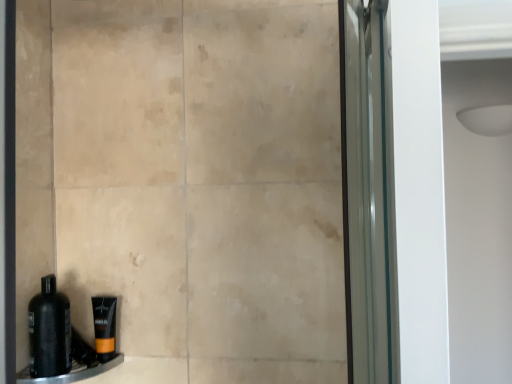
Question: From the image's perspective, is orange matte tube at lower left above black plastic ledge at lower left?

Choices:
 (A) yes
 (B) no

Answer: (A)

Question: From the image's perspective, is orange matte tube at lower left beneath black plastic ledge at lower left?

Choices:
 (A) no
 (B) yes

Answer: (A)

Question: Is orange matte tube at lower left positioned in front of black plastic ledge at lower left?

Choices:
 (A) no
 (B) yes

Answer: (A)

Question: Considering the relative sizes of orange matte tube at lower left and black plastic ledge at lower left in the image provided, is orange matte tube at lower left taller than black plastic ledge at lower left?

Choices:
 (A) yes
 (B) no

Answer: (A)

Question: Is orange matte tube at lower left outside black plastic ledge at lower left?

Choices:
 (A) no
 (B) yes

Answer: (B)

Question: Which is correct: black plastic ledge at lower left is inside black matte bottle at lower left, or outside of it?

Choices:
 (A) outside
 (B) inside

Answer: (A)

Question: From the image's perspective, relative to black matte bottle at lower left, is black plastic ledge at lower left above or below?

Choices:
 (A) below
 (B) above

Answer: (A)

Question: Considering the positions of point (57, 380) and point (53, 316), is point (57, 380) closer or farther from the camera than point (53, 316)?

Choices:
 (A) farther
 (B) closer

Answer: (B)

Question: In terms of width, does black plastic ledge at lower left look wider or thinner when compared to black matte bottle at lower left?

Choices:
 (A) wide
 (B) thin

Answer: (A)

Question: From the image's perspective, relative to orange matte tube at lower left, is black matte bottle at lower left above or below?

Choices:
 (A) below
 (B) above

Answer: (B)

Question: Is black matte bottle at lower left spatially inside orange matte tube at lower left, or outside of it?

Choices:
 (A) inside
 (B) outside

Answer: (B)

Question: In the image, is black matte bottle at lower left on the left side or the right side of orange matte tube at lower left?

Choices:
 (A) right
 (B) left

Answer: (B)

Question: From a real-world perspective, is black matte bottle at lower left above or below orange matte tube at lower left?

Choices:
 (A) below
 (B) above

Answer: (B)

Question: Is point (96, 309) positioned closer to the camera than point (117, 362)?

Choices:
 (A) farther
 (B) closer

Answer: (B)

Question: Relative to black plastic ledge at lower left, is orange matte tube at lower left in front or behind?

Choices:
 (A) front
 (B) behind

Answer: (B)